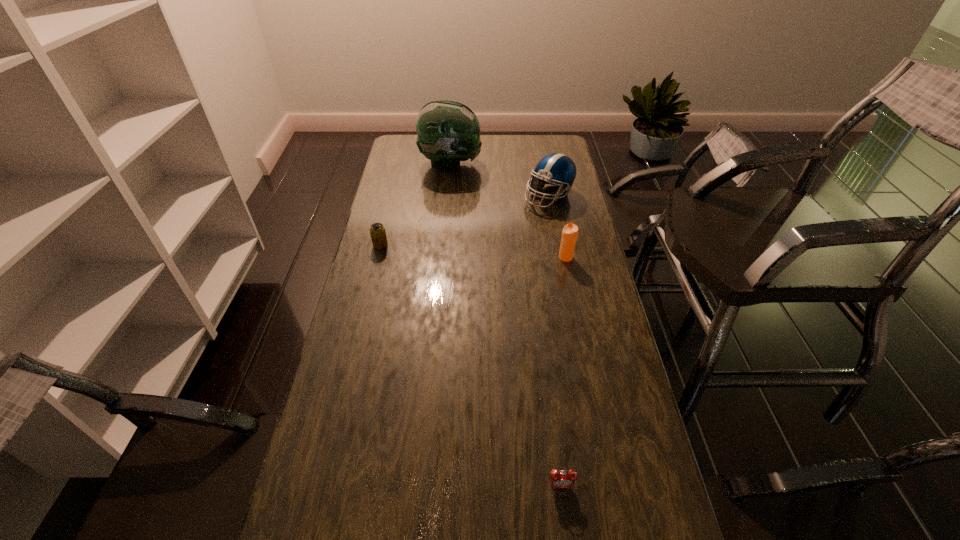
This screenshot has height=540, width=960. In order to click on the farthest object in this screenshot , I will do `click(448, 132)`.

In order to click on the taller football helmet in this screenshot , I will do `click(448, 132)`.

Image resolution: width=960 pixels, height=540 pixels. In order to click on the right football helmet in this screenshot , I will do `click(556, 169)`.

Find the location of a particular element. the nearer football helmet is located at coordinates (556, 169).

Identify the location of candle. (x=570, y=231).

The width and height of the screenshot is (960, 540). In order to click on beer can in this screenshot , I will do `click(377, 231)`.

Where is `the leftmost object`? The width and height of the screenshot is (960, 540). the leftmost object is located at coordinates (377, 231).

Locate an element on the screen. The height and width of the screenshot is (540, 960). the nearest object is located at coordinates (565, 478).

Find the location of a particular element. The height and width of the screenshot is (540, 960). free space located on the visor of the farthest object is located at coordinates (509, 164).

Find the location of `vacant space located 0.330m at the front of the fourth nearest object with the faceguard`. vacant space located 0.330m at the front of the fourth nearest object with the faceguard is located at coordinates (564, 272).